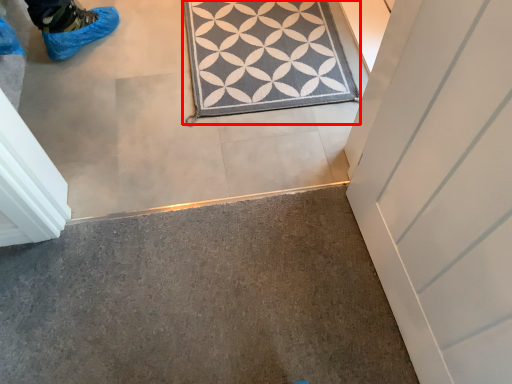
Question: In this image, where is doormat (annotated by the red box) located relative to concrete?

Choices:
 (A) left
 (B) right

Answer: (B)